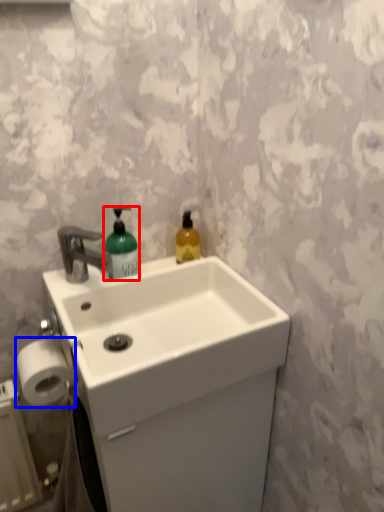
Question: Among these objects, which one is nearest to the camera, bottle (highlighted by a red box) or toilet paper (highlighted by a blue box)?

Choices:
 (A) bottle
 (B) toilet paper

Answer: (B)